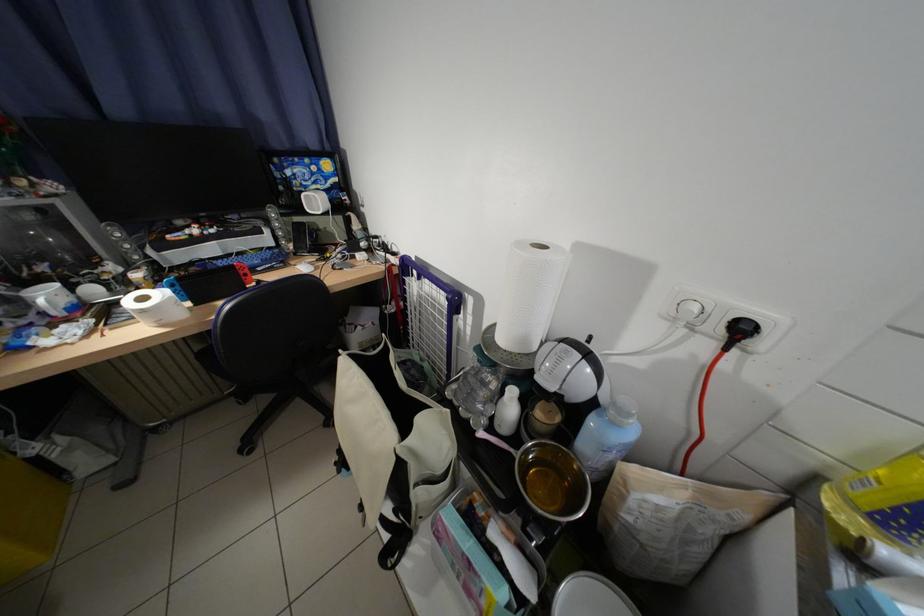
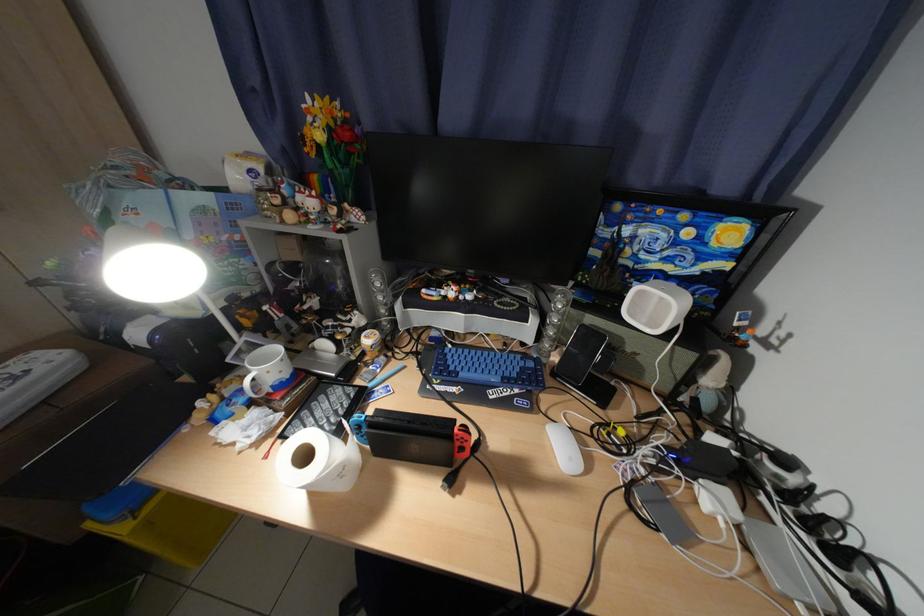
Find the pixel in the second image that matches the point at 350,257 in the first image.

(664, 463)